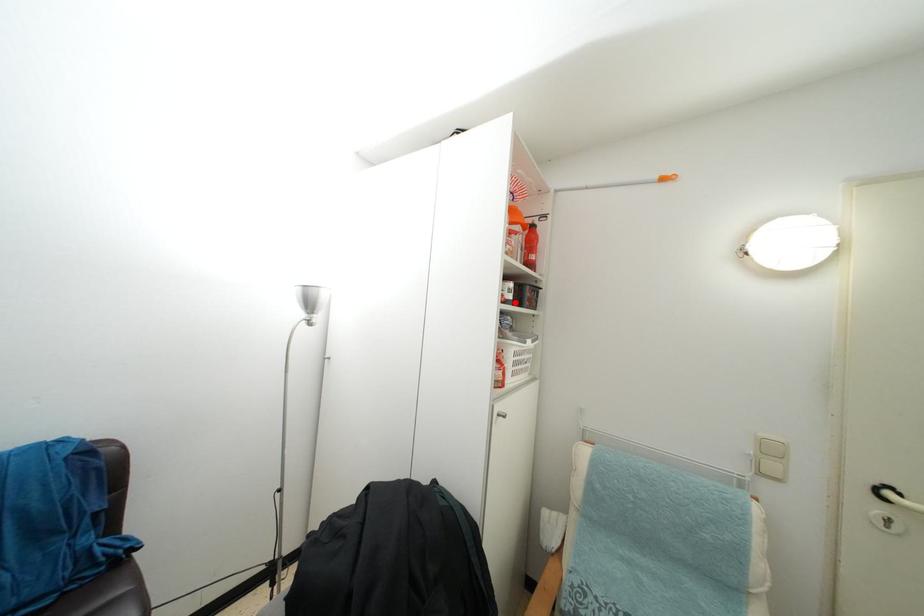
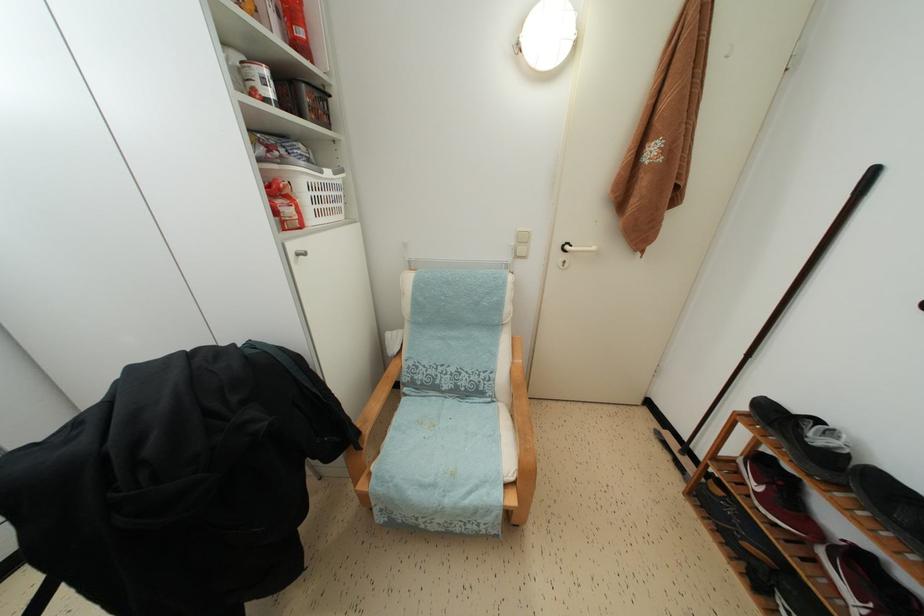
Locate, in the second image, the point that corresponds to the highlighted location in the first image.

(274, 100)